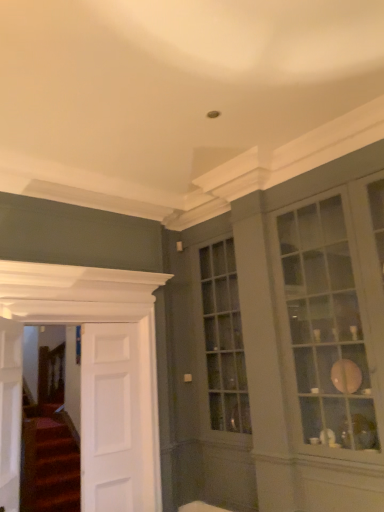
Question: Is matte glass cabinet at right to the right of white wooden door at left, which is counted as the second door, starting from the left, from the viewer's perspective?

Choices:
 (A) no
 (B) yes

Answer: (B)

Question: Does matte glass cabinet at right have a lesser height compared to white wooden door at left, which is counted as the second door, starting from the left?

Choices:
 (A) yes
 (B) no

Answer: (B)

Question: Is matte glass cabinet at right at the left side of white wooden door at left, placed as the second door when sorted from right to left?

Choices:
 (A) yes
 (B) no

Answer: (B)

Question: From a real-world perspective, is matte glass cabinet at right located beneath white wooden door at left, which is counted as the second door, starting from the left?

Choices:
 (A) yes
 (B) no

Answer: (B)

Question: From the image's perspective, does matte glass cabinet at right appear higher than white wooden door at left, which is counted as the second door, starting from the left?

Choices:
 (A) no
 (B) yes

Answer: (B)

Question: Is white wooden door at left, which is counted as the second door, starting from the left, a part of matte glass cabinet at right?

Choices:
 (A) no
 (B) yes

Answer: (A)

Question: Considering the relative sizes of matte glass cabinet at right and white smooth door at left, acting as the third door starting from the left, in the image provided, is matte glass cabinet at right thinner than white smooth door at left, acting as the third door starting from the left,?

Choices:
 (A) no
 (B) yes

Answer: (A)

Question: Is matte glass cabinet at right in front of white smooth door at left, acting as the third door starting from the left?

Choices:
 (A) yes
 (B) no

Answer: (A)

Question: Does matte glass cabinet at right have a lesser height compared to white smooth door at left, acting as the third door starting from the left?

Choices:
 (A) yes
 (B) no

Answer: (B)

Question: Can you confirm if matte glass cabinet at right is wider than white smooth door at left, which is counted as the 1th door, starting from the right?

Choices:
 (A) no
 (B) yes

Answer: (B)

Question: Is matte glass cabinet at right positioned beyond the bounds of white smooth door at left, acting as the third door starting from the left?

Choices:
 (A) no
 (B) yes

Answer: (B)

Question: Is white smooth door at left, which is counted as the 1th door, starting from the right, surrounded by matte glass cabinet at right?

Choices:
 (A) yes
 (B) no

Answer: (B)

Question: Is white wooden door at left, marked as the 3th door in a right-to-left arrangement, positioned before matte glass cabinet at right?

Choices:
 (A) yes
 (B) no

Answer: (B)